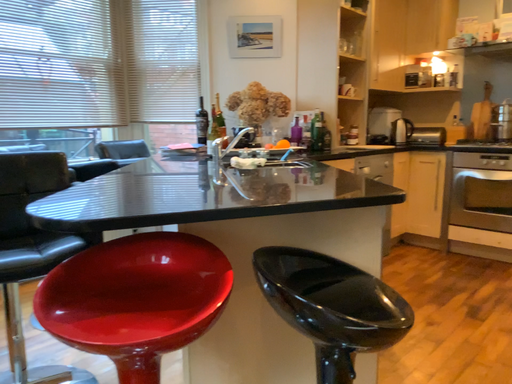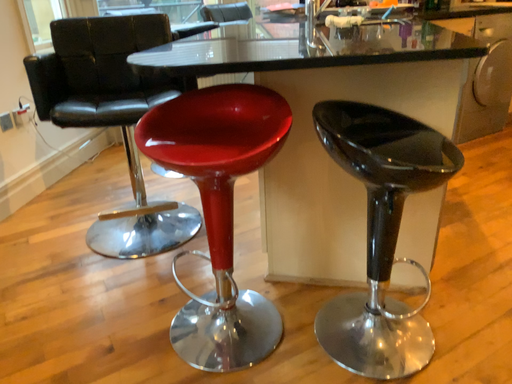
Question: Which way did the camera rotate in the video?

Choices:
 (A) rotated right
 (B) rotated left

Answer: (B)